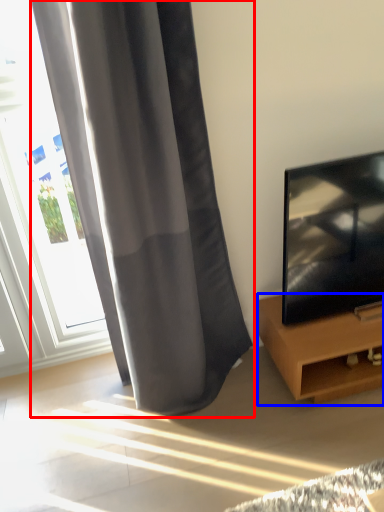
Question: Which object appears closest to the camera in this image, curtain (highlighted by a red box) or furniture (highlighted by a blue box)?

Choices:
 (A) curtain
 (B) furniture

Answer: (A)